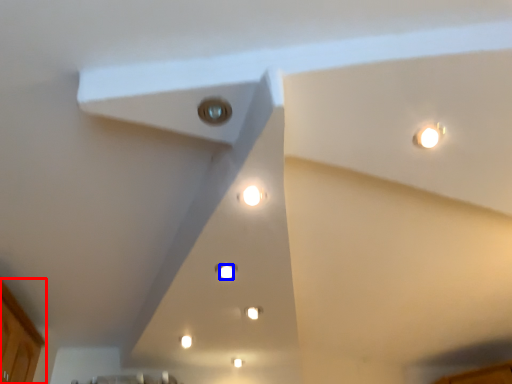
Question: Among these objects, which one is farthest to the camera, cabinetry (highlighted by a red box) or light (highlighted by a blue box)?

Choices:
 (A) cabinetry
 (B) light

Answer: (B)